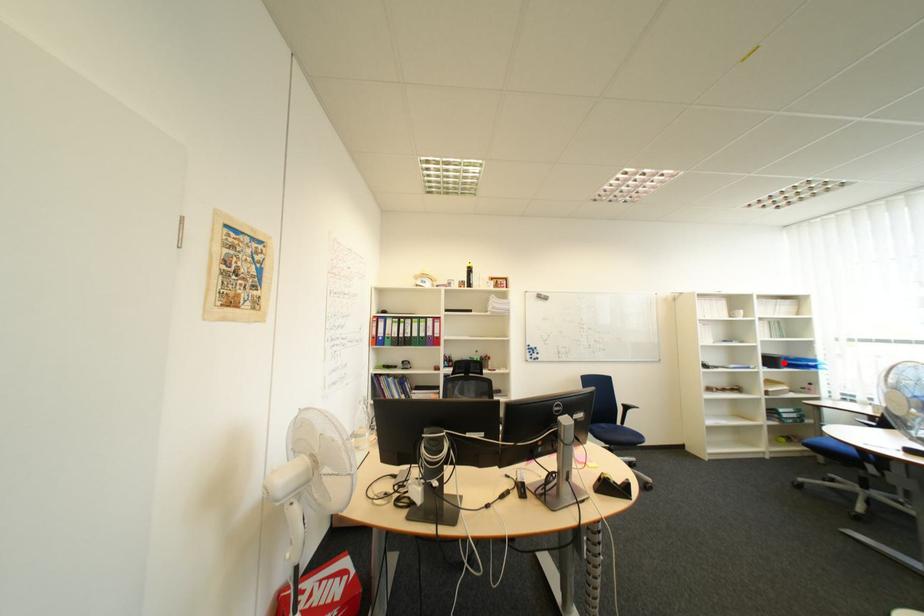
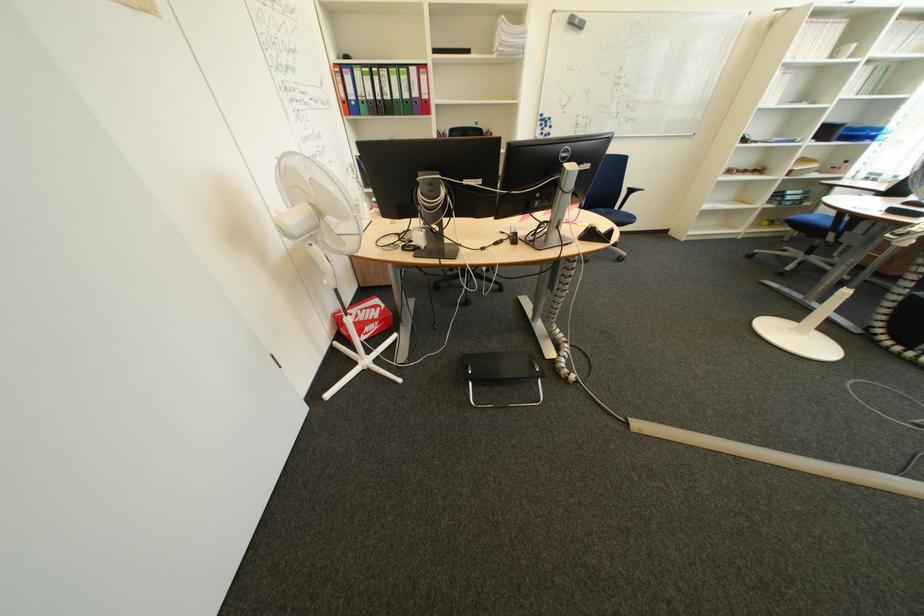
In the second image, find the point that corresponds to the highlighted location in the first image.

(840, 132)